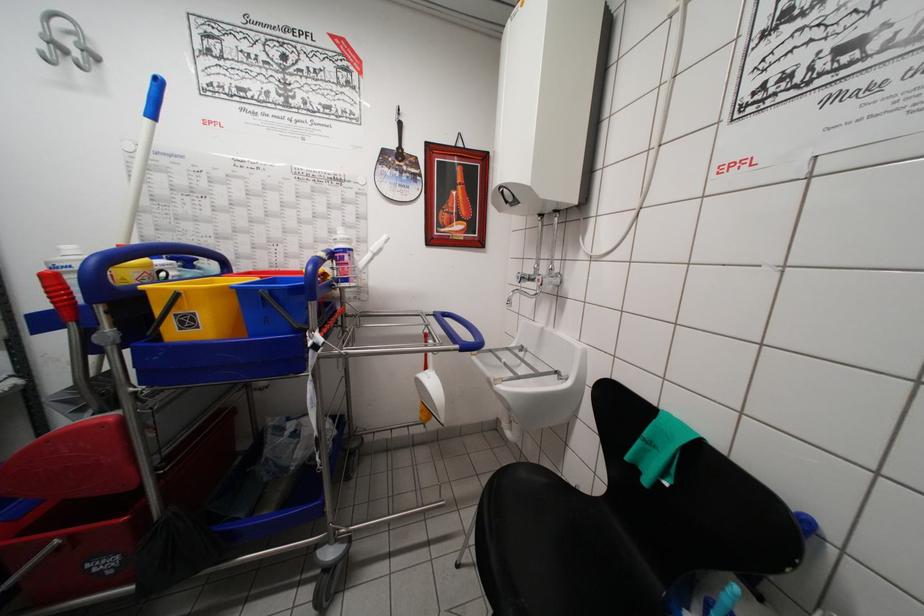
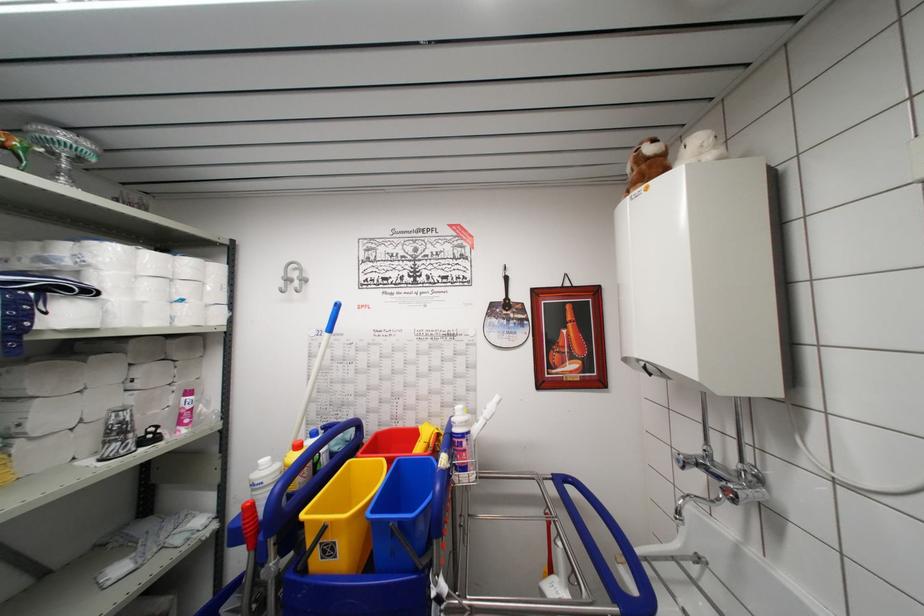
Locate, in the second image, the point that corresponds to point 343,261 in the first image.

(460, 447)